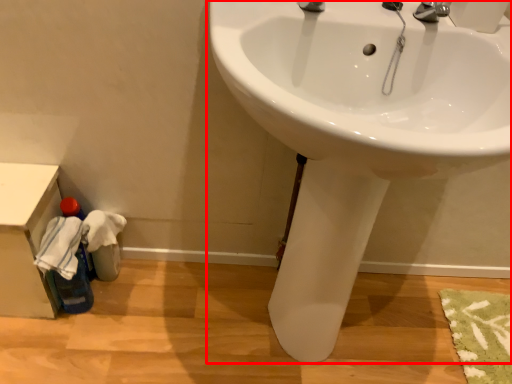
Question: From the image, what is the correct spatial relationship of sink (annotated by the red box) in relation to counter top?

Choices:
 (A) right
 (B) left

Answer: (A)